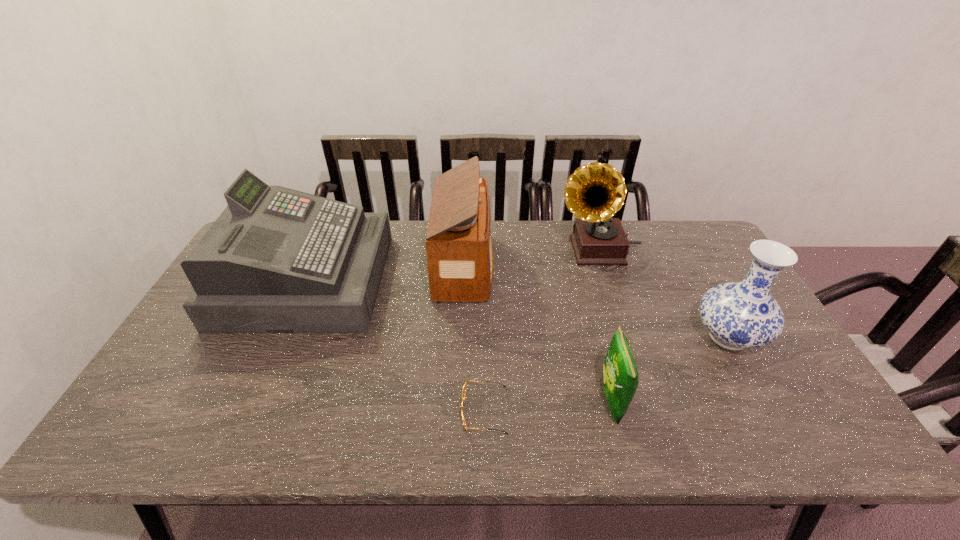
Where is `vacant space at the near left corner of the desktop`? vacant space at the near left corner of the desktop is located at coordinates (161, 430).

Where is `vacant area between the crisp (potato chip) and the spectacles`? This screenshot has width=960, height=540. vacant area between the crisp (potato chip) and the spectacles is located at coordinates point(548,406).

At what (x,y) coordinates should I click in order to perform the action: click on vacant space that is in between the radio receiver and the leftmost object. Please return your answer as a coordinate pair (x, y). The height and width of the screenshot is (540, 960). Looking at the image, I should click on (386, 273).

At what (x,y) coordinates should I click in order to perform the action: click on empty space between the radio receiver and the phonograph record. Please return your answer as a coordinate pair (x, y). Looking at the image, I should click on (531, 258).

Locate an element on the screen. This screenshot has height=540, width=960. free space between the spectacles and the fifth tallest object is located at coordinates (548, 406).

Locate an element on the screen. Image resolution: width=960 pixels, height=540 pixels. vacant space that's between the vase and the radio receiver is located at coordinates (596, 301).

I want to click on empty space between the vase and the phonograph record, so click(662, 293).

Locate an element on the screen. This screenshot has height=540, width=960. free space between the shortest object and the phonograph record is located at coordinates (541, 330).

The height and width of the screenshot is (540, 960). Find the location of `free space between the phonograph record and the spectacles`. free space between the phonograph record and the spectacles is located at coordinates pos(541,330).

Locate an element on the screen. This screenshot has width=960, height=540. vacant space that is in between the radio receiver and the rightmost object is located at coordinates (596, 301).